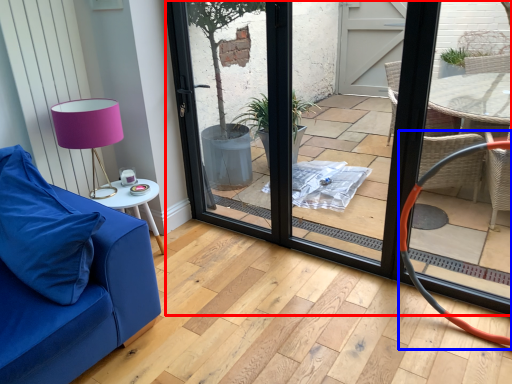
Question: Among these objects, which one is nearest to the camera, door (highlighted by a red box) or armchair (highlighted by a blue box)?

Choices:
 (A) door
 (B) armchair

Answer: (A)